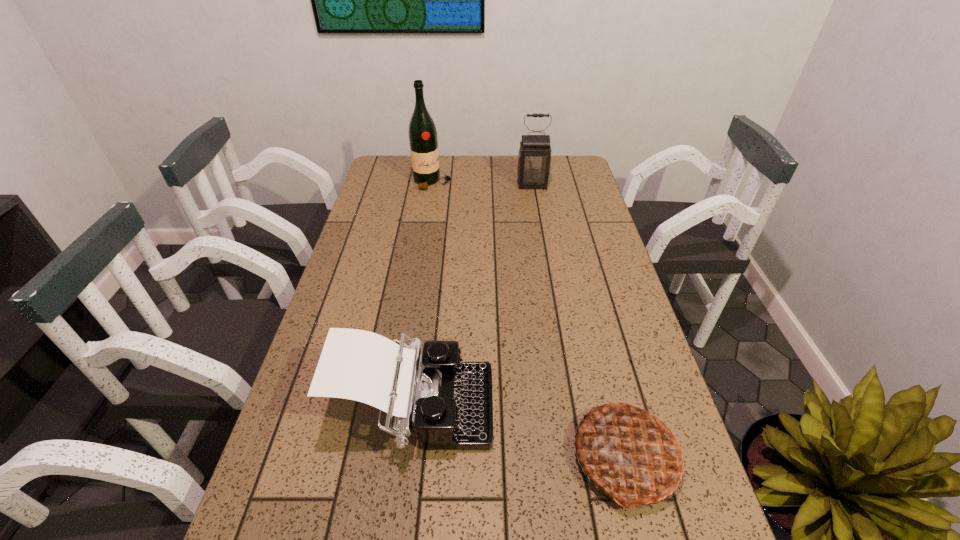
In the image, there is a desktop. Where is `vacant space at the far right corner`? The width and height of the screenshot is (960, 540). vacant space at the far right corner is located at coordinates (585, 183).

Identify the location of vacant area between the pie and the tallest object. (529, 320).

You are a GUI agent. You are given a task and a screenshot of the screen. Output one action in this format:
    pyautogui.click(x=<x>, y=<y>)
    Task: Click on the free spot between the pie and the typewriter
    The height and width of the screenshot is (540, 960).
    Given the screenshot: What is the action you would take?
    pyautogui.click(x=520, y=434)

The width and height of the screenshot is (960, 540). I want to click on vacant point located between the pie and the second tallest object, so (x=579, y=321).

This screenshot has height=540, width=960. Find the location of `empty space between the pie and the lantern`. empty space between the pie and the lantern is located at coordinates (579, 321).

Find the location of `free space that is in between the typewriter and the tallest object`. free space that is in between the typewriter and the tallest object is located at coordinates point(423,296).

I want to click on vacant point located between the wine bottle and the typewriter, so coord(423,296).

Where is `vacant space that's between the tallest object and the typewriter`? vacant space that's between the tallest object and the typewriter is located at coordinates (423, 296).

Find the location of `vacant space that is in between the pie and the wine bottle`. vacant space that is in between the pie and the wine bottle is located at coordinates 529,320.

This screenshot has width=960, height=540. Identify the location of vacant space that's between the third shortest object and the wine bottle. (482, 184).